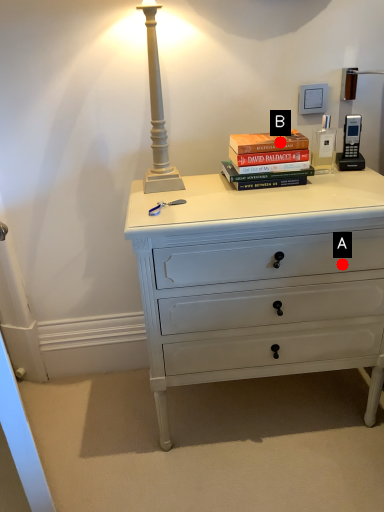
Question: Two points are circled on the image, labeled by A and B beside each circle. Which point appears farthest from the camera in this image?

Choices:
 (A) A is further
 (B) B is further

Answer: (B)